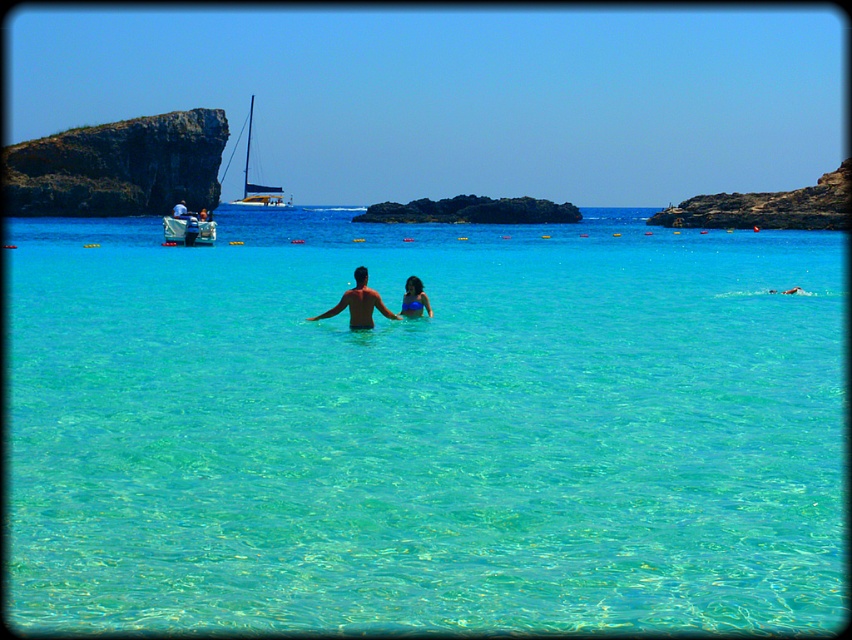
Question: Is white sailboat at upper left positioned at the back of blue fabric swimsuit at center?

Choices:
 (A) no
 (B) yes

Answer: (B)

Question: Considering the relative positions of rocky cliff at upper right and blue fabric swimsuit at center in the image provided, where is rocky cliff at upper right located with respect to blue fabric swimsuit at center?

Choices:
 (A) right
 (B) left

Answer: (A)

Question: Which point is closer to the camera?

Choices:
 (A) blue fabric swimsuit at center
 (B) rocky cliff at upper right
 (C) clear water at center
 (D) white sailboat at upper left

Answer: (C)

Question: Which object is the farthest from the clear water at center?

Choices:
 (A) matte skin couple at center
 (B) rocky cliff at upper right

Answer: (A)

Question: Can you confirm if clear water at center is positioned to the right of white sailboat at upper left?

Choices:
 (A) no
 (B) yes

Answer: (B)

Question: Which object is closer to the camera taking this photo?

Choices:
 (A) blue fabric swimsuit at center
 (B) matte skin couple at center
 (C) rocky cliff at upper right

Answer: (B)